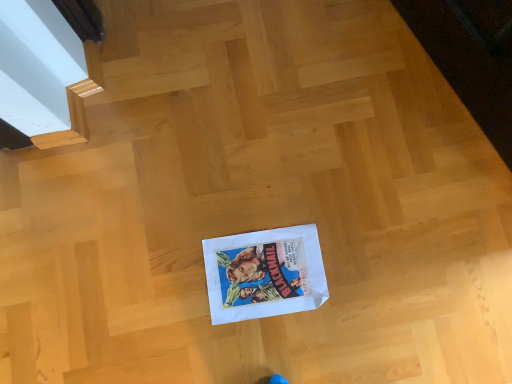
Describe the element at coordinates (264, 273) in the screenshot. The image size is (512, 384). I see `white paper flyer at center` at that location.

This screenshot has height=384, width=512. Find the location of `white paper flyer at center`. white paper flyer at center is located at coordinates (264, 273).

This screenshot has height=384, width=512. In order to click on white paper flyer at center in this screenshot , I will do `click(264, 273)`.